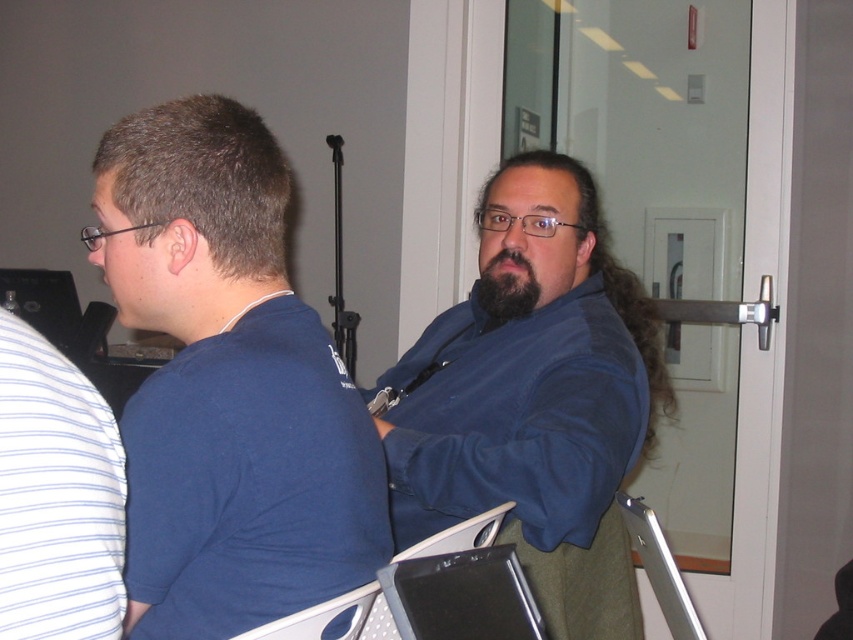
Question: Which object appears closest to the camera in this image?

Choices:
 (A) transparent glass door at center
 (B) blue cotton shirt at center

Answer: (B)

Question: From the image, what is the correct spatial relationship of blue cotton shirt at center in relation to matte plastic chair at center?

Choices:
 (A) right
 (B) left

Answer: (A)

Question: Can you confirm if transparent glass door at center is bigger than matte plastic chair at center?

Choices:
 (A) yes
 (B) no

Answer: (A)

Question: Estimate the real-world distances between objects in this image. Which object is closer to the transparent glass door at center?

Choices:
 (A) matte plastic chair at center
 (B) blue cotton shirt at center

Answer: (B)

Question: Does transparent glass door at center lie behind black fuzzy beard at center?

Choices:
 (A) yes
 (B) no

Answer: (A)

Question: Which point is farther to the camera?

Choices:
 (A) transparent glass door at center
 (B) blue cotton shirt at left
 (C) blue cotton shirt at center
 (D) matte plastic chair at center

Answer: (A)